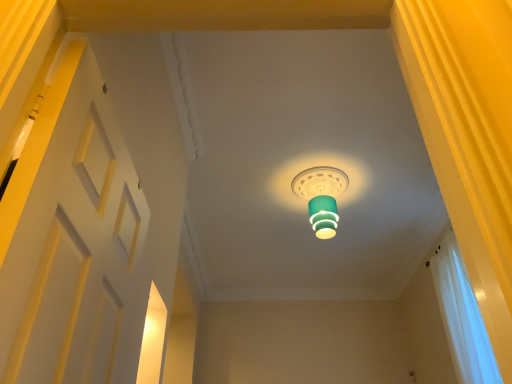
In order to face white matte door at left, should I rotate leftwards or rightwards?

Turn left approximately 19.309 degrees to face it.

Identify the location of teal glossy lampshade at center. The height and width of the screenshot is (384, 512). (321, 197).

Between teal glossy lampshade at center and white sheer curtain at right, which one appears on the left side from the viewer's perspective?

Positioned to the left is teal glossy lampshade at center.

Which of these two, teal glossy lampshade at center or white sheer curtain at right, is thinner?

white sheer curtain at right.

Looking at this image, considering the sizes of objects teal glossy lampshade at center and white sheer curtain at right in the image provided, who is shorter, teal glossy lampshade at center or white sheer curtain at right?

Standing shorter between the two is teal glossy lampshade at center.

Is teal glossy lampshade at center facing away from white sheer curtain at right?

That's not correct — teal glossy lampshade at center is not looking away from white sheer curtain at right.

Considering the sizes of white matte door at left and white sheer curtain at right in the image, is white matte door at left bigger or smaller than white sheer curtain at right?

Clearly, white matte door at left is smaller in size than white sheer curtain at right.

Between white matte door at left and white sheer curtain at right, which one has larger width?

white sheer curtain at right is wider.

Is there a large distance between white matte door at left and white sheer curtain at right?

white matte door at left is positioned a significant distance from white sheer curtain at right.

Is white sheer curtain at right in contact with teal glossy lampshade at center?

No.

I want to click on lamp behind the white sheer curtain at right, so pos(321,197).

From the image's perspective, would you say white sheer curtain at right is shown under teal glossy lampshade at center?

Indeed, from the image's perspective, white sheer curtain at right is shown beneath teal glossy lampshade at center.

Choose the correct answer: Is white sheer curtain at right inside teal glossy lampshade at center or outside it?

The correct answer is: outside.

Could you tell me if white sheer curtain at right is facing white matte door at left?

No, white sheer curtain at right is not aimed at white matte door at left.

Considering the positions of objects white sheer curtain at right and white matte door at left in the image provided, who is more to the left, white sheer curtain at right or white matte door at left?

From the viewer's perspective, white matte door at left appears more on the left side.

Locate an element on the screen. The height and width of the screenshot is (384, 512). door beneath the white sheer curtain at right (from a real-world perspective) is located at coordinates (68, 235).

Can you tell me how much white sheer curtain at right and white matte door at left differ in facing direction?

179 degrees separate the facing orientations of white sheer curtain at right and white matte door at left.

From a real-world perspective, is white matte door at left positioned over teal glossy lampshade at center based on gravity?

Incorrect, from a real-world perspective, white matte door at left is lower than teal glossy lampshade at center.

From the image's perspective, which is above, white matte door at left or teal glossy lampshade at center?

teal glossy lampshade at center.

Considering the sizes of white matte door at left and teal glossy lampshade at center in the image, is white matte door at left bigger or smaller than teal glossy lampshade at center?

white matte door at left is smaller than teal glossy lampshade at center.

At what (x,y) coordinates should I click in order to perform the action: click on door on the left of the teal glossy lampshade at center. Please return your answer as a coordinate pair (x, y). Looking at the image, I should click on (68, 235).

Considering the sizes of objects teal glossy lampshade at center and white matte door at left in the image provided, who is shorter, teal glossy lampshade at center or white matte door at left?

Standing shorter between the two is teal glossy lampshade at center.

Considering the sizes of objects teal glossy lampshade at center and white matte door at left in the image provided, who is smaller, teal glossy lampshade at center or white matte door at left?

white matte door at left is smaller.

Is teal glossy lampshade at center looking in the opposite direction of white matte door at left?

No.

Find the location of a particular element. This screenshot has height=384, width=512. lamp on the left of the white sheer curtain at right is located at coordinates (321, 197).

This screenshot has width=512, height=384. Find the location of `door above the white sheer curtain at right (from the image's perspective)`. door above the white sheer curtain at right (from the image's perspective) is located at coordinates (68, 235).

From the image, which object appears to be farther from teal glossy lampshade at center, white sheer curtain at right or white matte door at left?

white matte door at left lies further to teal glossy lampshade at center than the other object.

Estimate the real-world distances between objects in this image. Which object is closer to white matte door at left, white sheer curtain at right or teal glossy lampshade at center?

The object closer to white matte door at left is teal glossy lampshade at center.

When comparing their distances from teal glossy lampshade at center, does white matte door at left or white sheer curtain at right seem further?

The object further to teal glossy lampshade at center is white matte door at left.

Looking at the image, which one is located further to white sheer curtain at right, white matte door at left or teal glossy lampshade at center?

white matte door at left is positioned further to the anchor white sheer curtain at right.

When comparing their distances from white matte door at left, does teal glossy lampshade at center or white sheer curtain at right seem further?

white sheer curtain at right.

When comparing their distances from white sheer curtain at right, does teal glossy lampshade at center or white matte door at left seem closer?

teal glossy lampshade at center is closer to white sheer curtain at right.

Image resolution: width=512 pixels, height=384 pixels. Find the location of `curtain located between white matte door at left and teal glossy lampshade at center in the depth direction`. curtain located between white matte door at left and teal glossy lampshade at center in the depth direction is located at coordinates (462, 316).